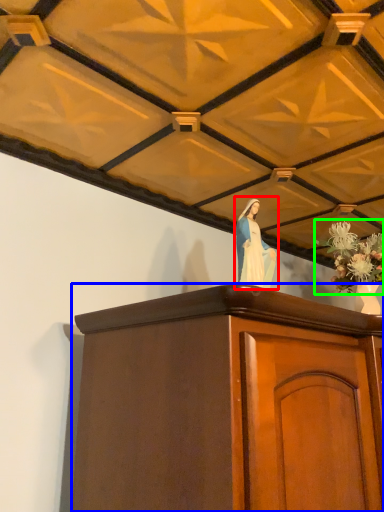
Question: Which is farther away from woman (highlighted by a red box)? furniture (highlighted by a blue box) or floral arrangement (highlighted by a green box)?

Choices:
 (A) furniture
 (B) floral arrangement

Answer: (B)